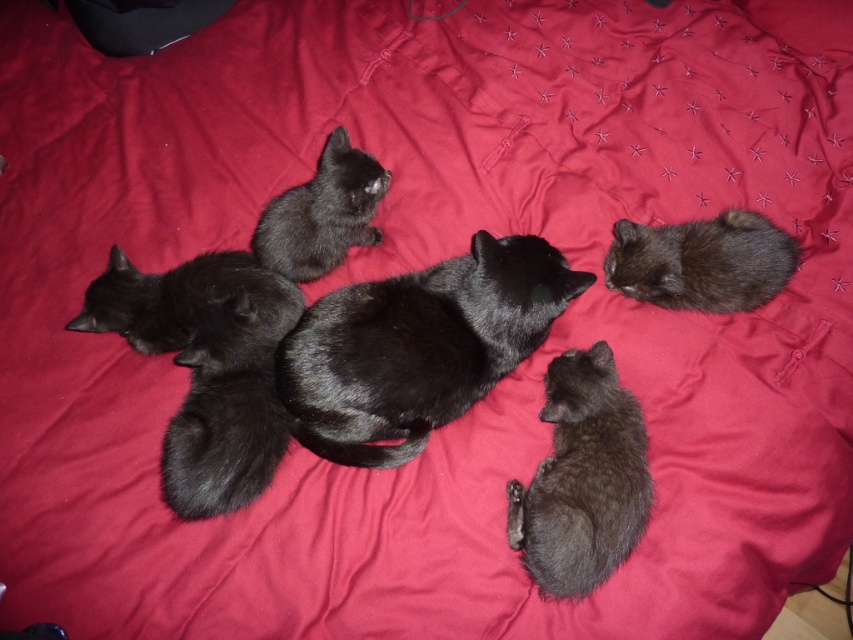
Can you confirm if soft fur kitten at center is shorter than matte black kitten at upper center?

No, soft fur kitten at center is not shorter than matte black kitten at upper center.

Who is higher up, soft fur kitten at center or matte black kitten at upper center?

Positioned higher is matte black kitten at upper center.

Measure the distance between point (648, 509) and camera.

3.50 feet

Where is `soft fur kitten at center`? This screenshot has width=853, height=640. soft fur kitten at center is located at coordinates (583, 477).

Is point (479, 337) positioned before point (190, 291)?

Yes, it is.

Is point (578, 276) closer to viewer compared to point (144, 323)?

Yes, point (578, 276) is closer to viewer.

Find the location of a particular element. shiny black cat at center is located at coordinates (416, 346).

Is shiny black cat at center below shiny black cat at upper right?

Correct, shiny black cat at center is located below shiny black cat at upper right.

What do you see at coordinates (416, 346) in the screenshot? The image size is (853, 640). I see `shiny black cat at center` at bounding box center [416, 346].

What do you see at coordinates (416, 346) in the screenshot? Image resolution: width=853 pixels, height=640 pixels. I see `shiny black cat at center` at bounding box center [416, 346].

This screenshot has width=853, height=640. What are the coordinates of `shiny black cat at center` in the screenshot? It's located at (416, 346).